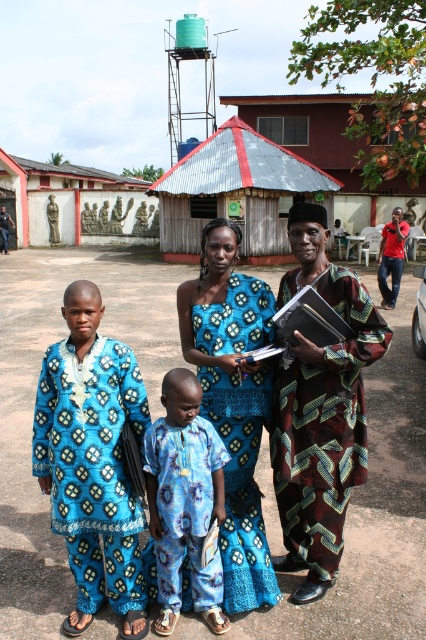
Question: Can you confirm if brown textured cloth at right is smaller than blue printed dress at center?

Choices:
 (A) yes
 (B) no

Answer: (B)

Question: Which point is closer to the camera?

Choices:
 (A) (233, 305)
 (B) (259, 166)
 (C) (210, 70)

Answer: (A)

Question: Estimate the real-world distances between objects in this image. Which object is farther from the blue printed fabric family at center?

Choices:
 (A) blue printed cloth at center
 (B) blue printed fabric shirt at center

Answer: (A)

Question: Observing the image, what is the correct spatial positioning of brown textured cloth at right in reference to metallic corrugated roof at center?

Choices:
 (A) left
 (B) right

Answer: (B)

Question: Estimate the real-world distances between objects in this image. Which object is farther from the brown textured cloth at right?

Choices:
 (A) metallic corrugated roof at center
 (B) blue printed cloth at center
 (C) carved wood figures at center
 (D) green plastic water tower at upper center

Answer: (D)

Question: Is blue printed cloth at center in front of metallic corrugated roof at center?

Choices:
 (A) no
 (B) yes

Answer: (B)